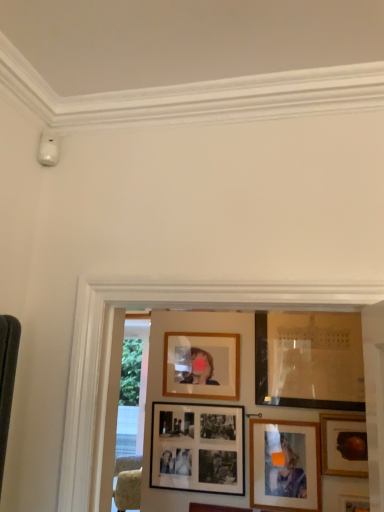
Question: Considering the relative positions of wooden photo frame at lower right, marked as the first picture frame in a bottom-to-top arrangement, and matte glass picture frame at upper right, which is counted as the sixth picture frame, starting from the bottom, in the image provided, is wooden photo frame at lower right, marked as the first picture frame in a bottom-to-top arrangement, in front of matte glass picture frame at upper right, which is counted as the sixth picture frame, starting from the bottom,?

Choices:
 (A) no
 (B) yes

Answer: (B)

Question: Does wooden photo frame at lower right, which is the 6th picture frame in top-to-bottom order, have a greater width compared to matte glass picture frame at upper right, which ranks as the 1th picture frame in top-to-bottom order?

Choices:
 (A) no
 (B) yes

Answer: (B)

Question: Is wooden photo frame at lower right, which is the 6th picture frame in top-to-bottom order, far away from matte glass picture frame at upper right, which ranks as the 1th picture frame in top-to-bottom order?

Choices:
 (A) yes
 (B) no

Answer: (B)

Question: Considering the relative sizes of wooden photo frame at lower right, marked as the first picture frame in a bottom-to-top arrangement, and matte glass picture frame at upper right, which ranks as the 1th picture frame in top-to-bottom order, in the image provided, is wooden photo frame at lower right, marked as the first picture frame in a bottom-to-top arrangement, thinner than matte glass picture frame at upper right, which ranks as the 1th picture frame in top-to-bottom order,?

Choices:
 (A) yes
 (B) no

Answer: (B)

Question: Is wooden photo frame at lower right, which is the 6th picture frame in top-to-bottom order, smaller than matte glass picture frame at upper right, which is counted as the sixth picture frame, starting from the bottom?

Choices:
 (A) no
 (B) yes

Answer: (B)

Question: Is wooden photo frame at lower right, which is the 6th picture frame in top-to-bottom order, directly adjacent to matte glass picture frame at upper right, which is counted as the sixth picture frame, starting from the bottom?

Choices:
 (A) yes
 (B) no

Answer: (B)

Question: Does matte glass picture frame at upper right, which ranks as the 1th picture frame in top-to-bottom order, have a greater width compared to gold-framed painting at lower right, the 4th picture frame from the bottom?

Choices:
 (A) no
 (B) yes

Answer: (A)

Question: Is matte glass picture frame at upper right, which ranks as the 1th picture frame in top-to-bottom order, further to camera compared to gold-framed painting at lower right, which appears as the third picture frame when viewed from the top?

Choices:
 (A) no
 (B) yes

Answer: (B)

Question: Is gold-framed painting at lower right, which appears as the third picture frame when viewed from the top, located within matte glass picture frame at upper right, which is counted as the sixth picture frame, starting from the bottom?

Choices:
 (A) yes
 (B) no

Answer: (B)

Question: Does matte glass picture frame at upper right, which is counted as the sixth picture frame, starting from the bottom, have a lesser height compared to gold-framed painting at lower right, the 4th picture frame from the bottom?

Choices:
 (A) yes
 (B) no

Answer: (B)

Question: From the image's perspective, is matte glass picture frame at upper right, which is counted as the sixth picture frame, starting from the bottom, located above gold-framed painting at lower right, which appears as the third picture frame when viewed from the top?

Choices:
 (A) no
 (B) yes

Answer: (B)

Question: Considering the relative sizes of matte glass picture frame at upper right, which is counted as the sixth picture frame, starting from the bottom, and gold-framed painting at lower right, which appears as the third picture frame when viewed from the top, in the image provided, is matte glass picture frame at upper right, which is counted as the sixth picture frame, starting from the bottom, thinner than gold-framed painting at lower right, which appears as the third picture frame when viewed from the top,?

Choices:
 (A) no
 (B) yes

Answer: (B)

Question: Is matte glass picture frame at upper right, which ranks as the 1th picture frame in top-to-bottom order, further to camera compared to wooden photo frame at lower right, which is the 6th picture frame in top-to-bottom order?

Choices:
 (A) no
 (B) yes

Answer: (B)